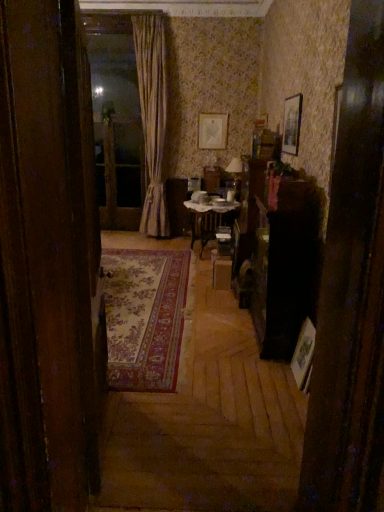
Question: Is wooden picture frame at right, the 2th picture frame positioned from the left, turned away from transparent glass screen door at upper center?

Choices:
 (A) no
 (B) yes

Answer: (A)

Question: Is wooden picture frame at right, the 2th picture frame positioned from the left, to the left of transparent glass screen door at upper center from the viewer's perspective?

Choices:
 (A) no
 (B) yes

Answer: (A)

Question: From the image's perspective, is wooden picture frame at right, which appears as the 1th picture frame when ordered from the bottom, on top of transparent glass screen door at upper center?

Choices:
 (A) no
 (B) yes

Answer: (A)

Question: From a real-world perspective, is wooden picture frame at right, the 2th picture frame positioned from the left, on top of transparent glass screen door at upper center?

Choices:
 (A) yes
 (B) no

Answer: (B)

Question: Are wooden picture frame at right, the 2th picture frame positioned from the left, and transparent glass screen door at upper center far apart?

Choices:
 (A) no
 (B) yes

Answer: (B)

Question: Would you say transparent glass screen door at upper center is part of wooden picture frame at right, which ranks as the 1th picture frame in front-to-back order,'s contents?

Choices:
 (A) yes
 (B) no

Answer: (B)

Question: Does wooden picture frame at right, the 3th picture frame from the back, have a greater width compared to gold textured curtain at center?

Choices:
 (A) no
 (B) yes

Answer: (A)

Question: From the image's perspective, is wooden picture frame at right, which ranks as the 1th picture frame in front-to-back order, over gold textured curtain at center?

Choices:
 (A) no
 (B) yes

Answer: (A)

Question: Can you confirm if wooden picture frame at right, the 3th picture frame from the back, is taller than gold textured curtain at center?

Choices:
 (A) no
 (B) yes

Answer: (A)

Question: Is wooden picture frame at right, the 3th picture frame from the back, oriented away from gold textured curtain at center?

Choices:
 (A) no
 (B) yes

Answer: (A)

Question: Considering the relative sizes of wooden picture frame at right, the 3th picture frame from the back, and gold textured curtain at center in the image provided, is wooden picture frame at right, the 3th picture frame from the back, bigger than gold textured curtain at center?

Choices:
 (A) no
 (B) yes

Answer: (A)

Question: From a real-world perspective, does wooden picture frame at right, which appears as the 1th picture frame when ordered from the bottom, stand above gold textured curtain at center?

Choices:
 (A) yes
 (B) no

Answer: (B)

Question: Considering the relative positions of matte gold picture frame at upper center, which is the third picture frame in right-to-left order, and wooden picture frame at right, the 2th picture frame positioned from the left, in the image provided, is matte gold picture frame at upper center, which is the third picture frame in right-to-left order, behind wooden picture frame at right, the 2th picture frame positioned from the left,?

Choices:
 (A) yes
 (B) no

Answer: (A)